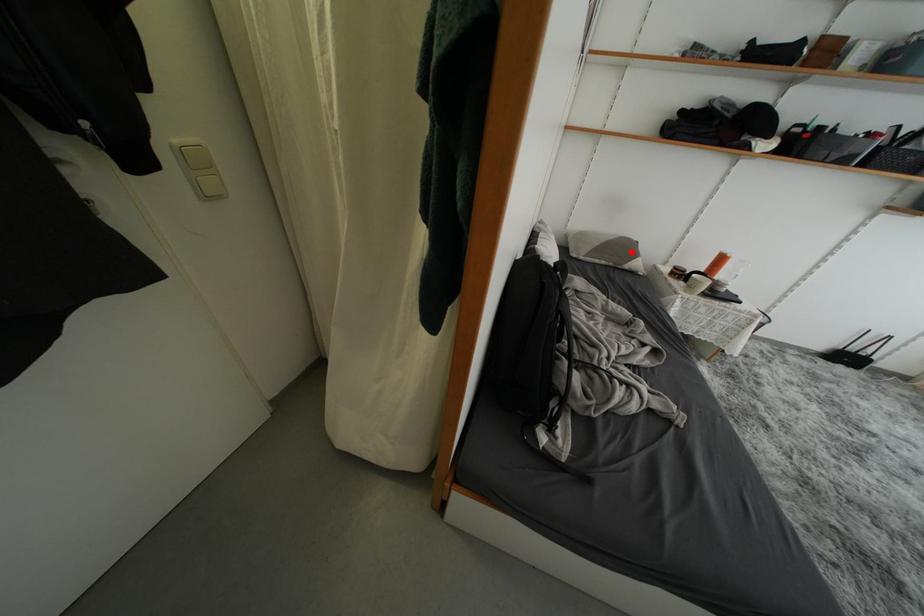
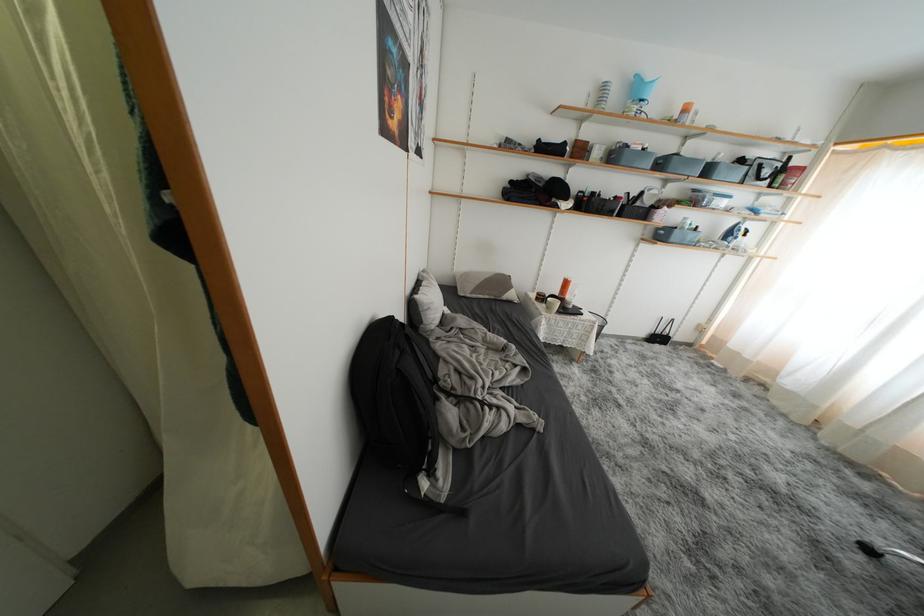
The point at the highlighted location is marked in the first image. Where is the corresponding point in the second image?

(508, 286)